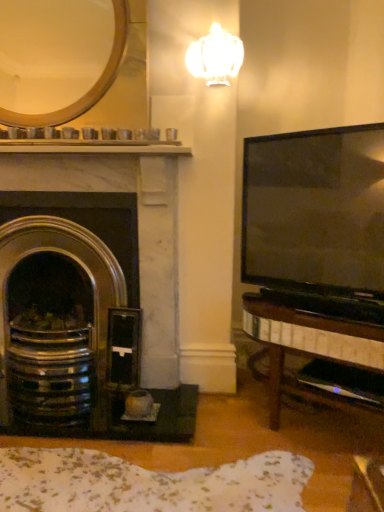
Question: Is white glossy lamp at upper center facing away from polished brass fireplace at left?

Choices:
 (A) yes
 (B) no

Answer: (B)

Question: Is white glossy lamp at upper center at the right side of polished brass fireplace at left?

Choices:
 (A) no
 (B) yes

Answer: (B)

Question: Is white glossy lamp at upper center taller than polished brass fireplace at left?

Choices:
 (A) yes
 (B) no

Answer: (B)

Question: Does white glossy lamp at upper center have a greater width compared to polished brass fireplace at left?

Choices:
 (A) no
 (B) yes

Answer: (A)

Question: Can you confirm if white glossy lamp at upper center is smaller than polished brass fireplace at left?

Choices:
 (A) no
 (B) yes

Answer: (B)

Question: Is white glossy lamp at upper center facing towards polished brass fireplace at left?

Choices:
 (A) yes
 (B) no

Answer: (B)

Question: Is polished brass fireplace at left next to white glossy lamp at upper center and touching it?

Choices:
 (A) yes
 (B) no

Answer: (B)

Question: From the image's perspective, is polished brass fireplace at left below white glossy lamp at upper center?

Choices:
 (A) yes
 (B) no

Answer: (A)

Question: Is polished brass fireplace at left facing away from white glossy lamp at upper center?

Choices:
 (A) no
 (B) yes

Answer: (A)

Question: Could you tell me if polished brass fireplace at left is turned towards white glossy lamp at upper center?

Choices:
 (A) yes
 (B) no

Answer: (B)

Question: Would you say white glossy lamp at upper center is part of polished brass fireplace at left's contents?

Choices:
 (A) yes
 (B) no

Answer: (B)

Question: From a real-world perspective, is polished brass fireplace at left over white glossy lamp at upper center?

Choices:
 (A) yes
 (B) no

Answer: (B)

Question: Considering the relative sizes of gold metallic mirror at upper left and polished brass fireplace at left in the image provided, is gold metallic mirror at upper left wider than polished brass fireplace at left?

Choices:
 (A) yes
 (B) no

Answer: (B)